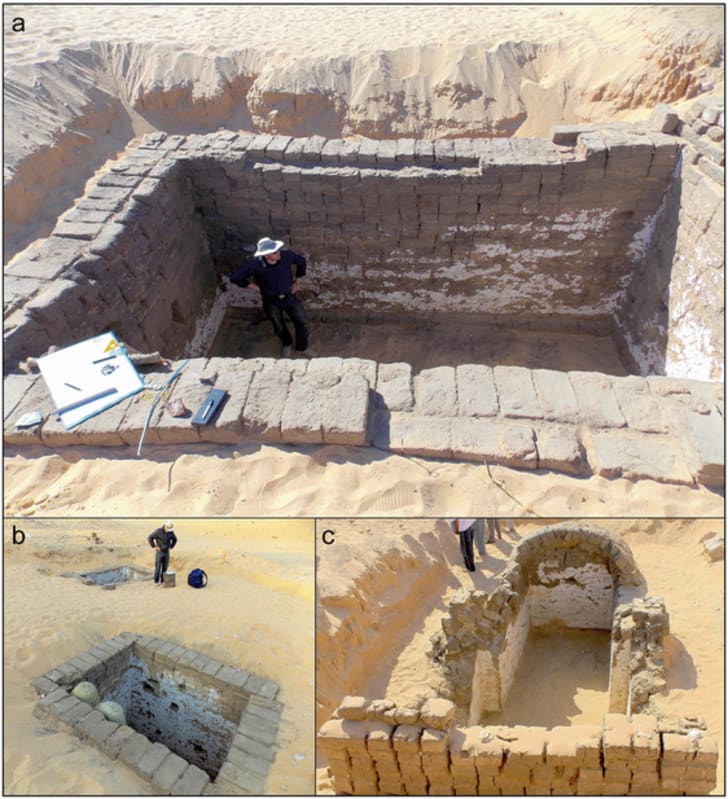
Image resolution: width=728 pixels, height=799 pixels. In order to click on sketchpad in this screenshot , I will do `click(70, 356)`.